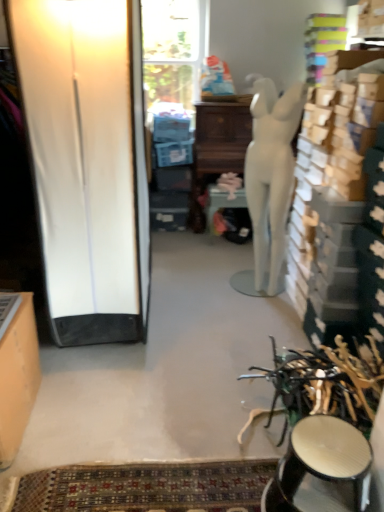
Question: From the image's perspective, is white matte mannequin at center located above patterned carpet at lower center?

Choices:
 (A) yes
 (B) no

Answer: (A)

Question: From a real-world perspective, is white matte mannequin at center physically below patterned carpet at lower center?

Choices:
 (A) yes
 (B) no

Answer: (B)

Question: Does white matte mannequin at center have a lesser width compared to patterned carpet at lower center?

Choices:
 (A) no
 (B) yes

Answer: (A)

Question: Can you confirm if white matte mannequin at center is wider than patterned carpet at lower center?

Choices:
 (A) no
 (B) yes

Answer: (B)

Question: Is the depth of white matte mannequin at center less than that of patterned carpet at lower center?

Choices:
 (A) no
 (B) yes

Answer: (A)

Question: In terms of height, does white matte mannequin at center look taller or shorter compared to matte orange cabinet at left?

Choices:
 (A) short
 (B) tall

Answer: (B)

Question: Considering their positions, is white matte mannequin at center located in front of or behind matte orange cabinet at left?

Choices:
 (A) behind
 (B) front

Answer: (A)

Question: Is white matte mannequin at center bigger or smaller than matte orange cabinet at left?

Choices:
 (A) big
 (B) small

Answer: (A)

Question: Visually, is white matte mannequin at center positioned to the left or to the right of matte orange cabinet at left?

Choices:
 (A) right
 (B) left

Answer: (A)

Question: From their relative heights in the image, would you say matte orange cabinet at left is taller or shorter than shiny metallic stool at lower right?

Choices:
 (A) short
 (B) tall

Answer: (B)

Question: Considering the positions of matte orange cabinet at left and shiny metallic stool at lower right in the image, is matte orange cabinet at left wider or thinner than shiny metallic stool at lower right?

Choices:
 (A) wide
 (B) thin

Answer: (B)

Question: Relative to shiny metallic stool at lower right, is matte orange cabinet at left in front or behind?

Choices:
 (A) behind
 (B) front

Answer: (A)

Question: Is point (16, 300) positioned closer to the camera than point (284, 461)?

Choices:
 (A) closer
 (B) farther

Answer: (B)

Question: Choose the correct answer: Is white glossy screen door at left inside matte orange cabinet at left or outside it?

Choices:
 (A) outside
 (B) inside

Answer: (A)

Question: From a real-world perspective, is white glossy screen door at left positioned above or below matte orange cabinet at left?

Choices:
 (A) below
 (B) above

Answer: (B)